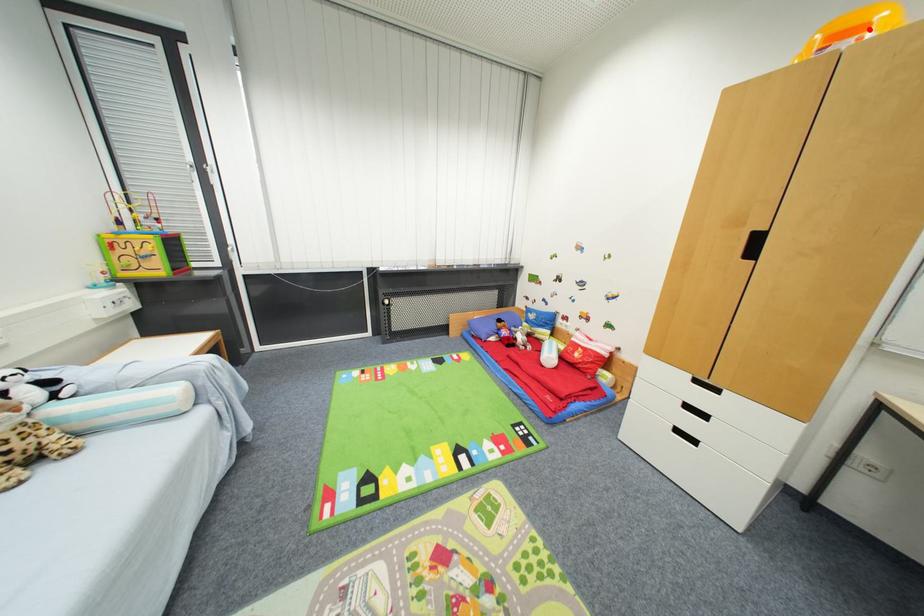
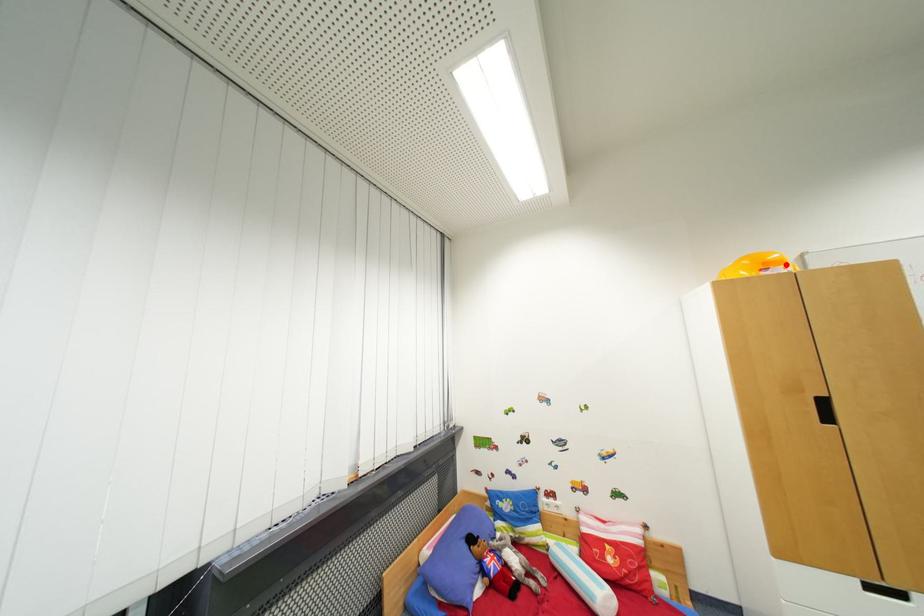
I am providing you with two images of the same scene from different viewpoints. A red point is marked on the first image and another point is marked on the second image. Does the point marked in image1 correspond to the same location as the one in image2?

Yes